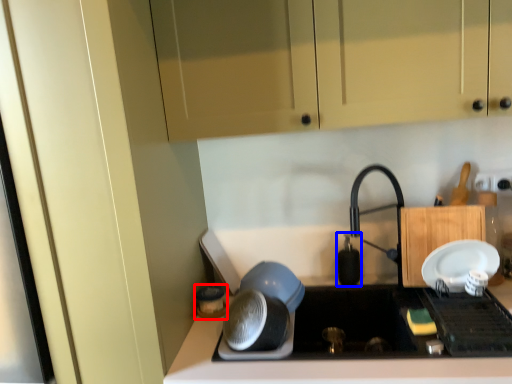
Question: Which object appears farthest to the camera in this image, appliance (highlighted by a red box) or appliance (highlighted by a blue box)?

Choices:
 (A) appliance
 (B) appliance

Answer: (B)